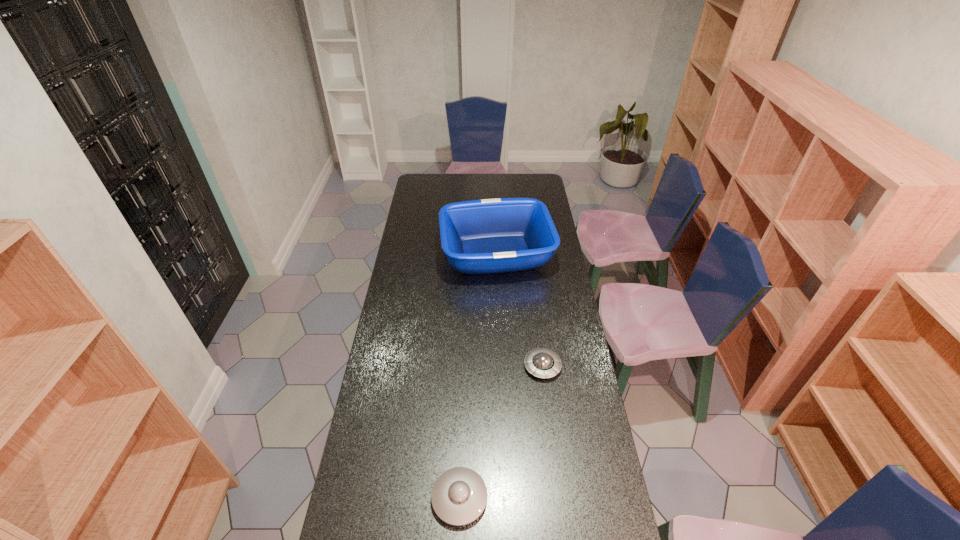
The height and width of the screenshot is (540, 960). Find the location of `saucer that is at the right edge`. saucer that is at the right edge is located at coordinates (543, 363).

Image resolution: width=960 pixels, height=540 pixels. Find the location of `vacant area at the far edge`. vacant area at the far edge is located at coordinates (443, 173).

The width and height of the screenshot is (960, 540). I want to click on free space at the left edge of the desktop, so click(x=371, y=396).

In the image, there is a desktop. At what (x,y) coordinates should I click in order to perform the action: click on vacant space at the right edge. Please return your answer as a coordinate pair (x, y). The image size is (960, 540). Looking at the image, I should click on (523, 198).

The height and width of the screenshot is (540, 960). I want to click on vacant space at the far left corner of the desktop, so click(x=433, y=193).

This screenshot has width=960, height=540. What are the coordinates of `free space at the far right corner of the desktop` in the screenshot? It's located at (521, 181).

Find the location of `empty space between the tray and the second farthest object`. empty space between the tray and the second farthest object is located at coordinates (519, 310).

At what (x,y) coordinates should I click in order to perform the action: click on empty space between the second farthest object and the tray. Please return your answer as a coordinate pair (x, y). The image size is (960, 540). Looking at the image, I should click on (519, 310).

You are a GUI agent. You are given a task and a screenshot of the screen. Output one action in this format:
    pyautogui.click(x=<x>, y=<y>)
    Task: Click on the free space between the tray and the farther saucer
    The image size is (960, 540).
    Given the screenshot: What is the action you would take?
    pyautogui.click(x=519, y=310)

Find the location of `free area in between the tallest object and the farther saucer`. free area in between the tallest object and the farther saucer is located at coordinates (519, 310).